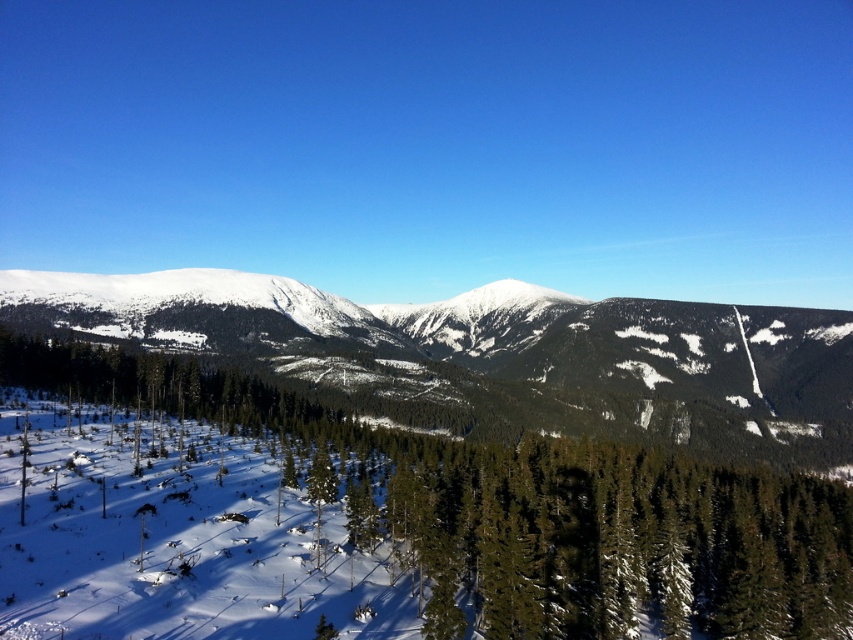
You are planning a hiking route through the winter landscape and need to decide whether the green matte tree at lower left is located beneath the snowy mountain at center. Based on the scene, can you confirm this spatial relationship?

The green matte tree at lower left is positioned under the snowy mountain at center, so yes, the tree is indeed located beneath the mountain.

You are planning to place a small wooden bench in the winter landscape scene. The bench requires a clear, flat area that is not under any trees to avoid falling snow. Considering the green matte tree at lower left, where should you place the bench to ensure it is not under its branches?

The green matte tree at lower left is located at point [515,509], so the bench should be placed away from this coordinate to avoid being under its branches.

You are an outdoor enthusiast planning a winter hike and see the image. You want to reach the snowy mountain at center. From your current position at the green matte tree at lower left, which direction should you head to avoid the dense forest? The answer must use the objects mentioned.

Since the green matte tree at lower left is in front of the snowy mountain at center, you should head away from the tree towards the mountain to avoid the dense forest behind you.